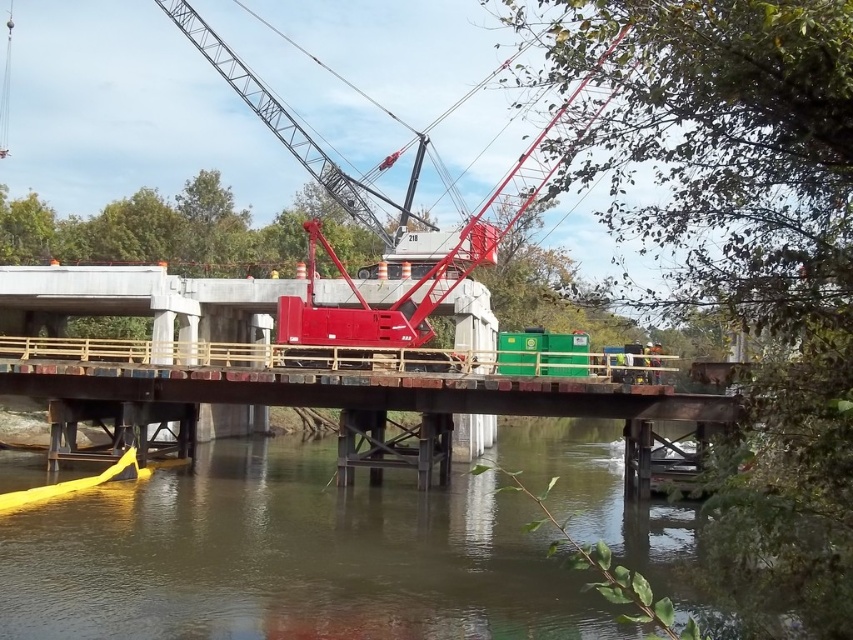
You are a construction inspector standing on the temporary bridge. You need to check the stability of the metal bridge at lower center and the metallic red crane at center. According to the scene, which object is positioned to the right of the other?

The metal bridge at lower center is to the right of the metallic red crane at center, so the metal bridge is positioned to the right of the crane.

You are a construction worker standing at the point with coordinates point (424, 332). You need to reach the point (654, 396) to secure a safety barrier. Which direction should you move relative to the other point?

You should move forward towards point (654, 396) because it is in front of point (424, 332).